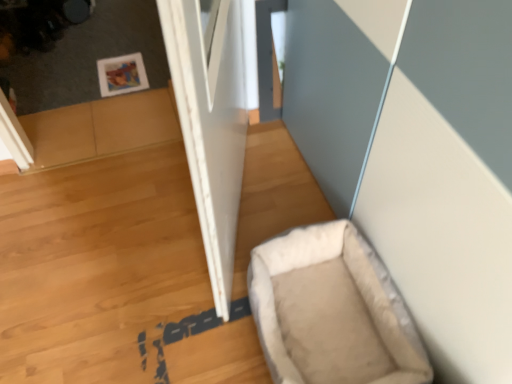
Question: From a real-world perspective, does beige fabric dog bed at lower right stand above white matte door at center?

Choices:
 (A) yes
 (B) no

Answer: (B)

Question: Is white matte door at center at the back of beige fabric dog bed at lower right?

Choices:
 (A) yes
 (B) no

Answer: (B)

Question: From the image's perspective, would you say beige fabric dog bed at lower right is positioned over white matte door at center?

Choices:
 (A) yes
 (B) no

Answer: (B)

Question: Considering the relative positions of beige fabric dog bed at lower right and white matte door at center in the image provided, is beige fabric dog bed at lower right to the right of white matte door at center from the viewer's perspective?

Choices:
 (A) no
 (B) yes

Answer: (B)

Question: Considering the relative sizes of beige fabric dog bed at lower right and white matte door at center in the image provided, is beige fabric dog bed at lower right wider than white matte door at center?

Choices:
 (A) no
 (B) yes

Answer: (B)

Question: From a real-world perspective, is beige fabric dog bed at lower right under white matte door at center?

Choices:
 (A) no
 (B) yes

Answer: (B)

Question: From the image's perspective, does white matte door at center appear lower than beige fabric dog bed at lower right?

Choices:
 (A) no
 (B) yes

Answer: (A)

Question: From a real-world perspective, does white matte door at center sit lower than beige fabric dog bed at lower right?

Choices:
 (A) yes
 (B) no

Answer: (B)

Question: From a real-world perspective, is white matte door at center physically above beige fabric dog bed at lower right?

Choices:
 (A) yes
 (B) no

Answer: (A)

Question: Considering the relative sizes of white matte door at center and beige fabric dog bed at lower right in the image provided, is white matte door at center shorter than beige fabric dog bed at lower right?

Choices:
 (A) no
 (B) yes

Answer: (A)

Question: Is white matte door at center outside beige fabric dog bed at lower right?

Choices:
 (A) no
 (B) yes

Answer: (B)

Question: Can you confirm if white matte door at center is wider than beige fabric dog bed at lower right?

Choices:
 (A) no
 (B) yes

Answer: (A)

Question: In the image, is white matte door at center on the left side or the right side of beige fabric dog bed at lower right?

Choices:
 (A) left
 (B) right

Answer: (A)